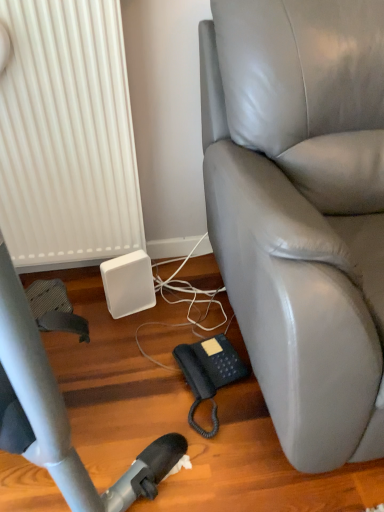
Where is `free spot to the left of white matte speaker at lower left`? The height and width of the screenshot is (512, 384). free spot to the left of white matte speaker at lower left is located at coordinates (89, 307).